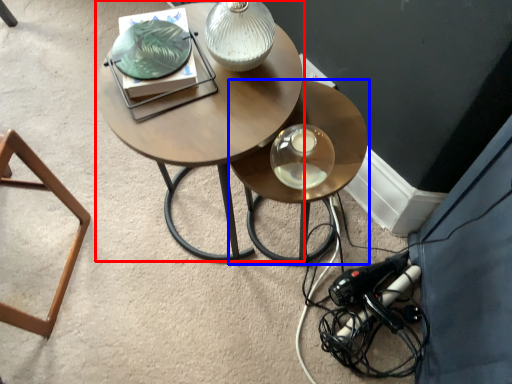
Question: Among these objects, which one is farthest to the camera, coffee table (highlighted by a red box) or table (highlighted by a blue box)?

Choices:
 (A) coffee table
 (B) table

Answer: (B)